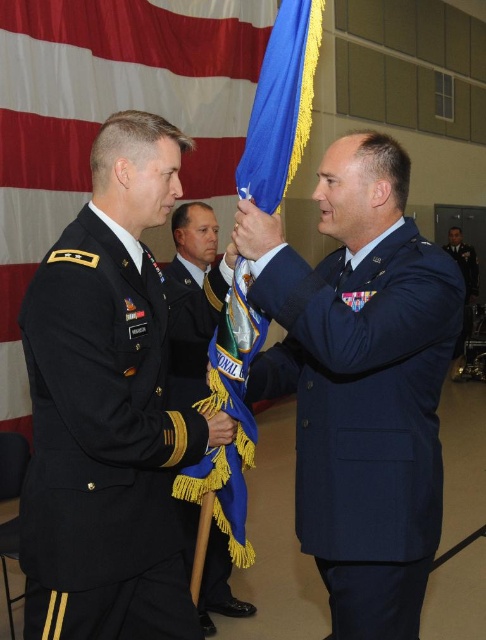
Between black matte uniform at left and blue satin flag at center, which one appears on the left side from the viewer's perspective?

Positioned to the left is black matte uniform at left.

Can you confirm if black matte uniform at left is shorter than blue satin flag at center?

In fact, black matte uniform at left may be taller than blue satin flag at center.

Between point (58, 513) and point (243, 604), which one is positioned behind?

Positioned behind is point (243, 604).

Locate an element on the screen. black matte uniform at left is located at coordinates (104, 442).

Is black matte uniform at left above blue fabric uniform at right?

No.

Is black matte uniform at left bigger than blue fabric uniform at right?

Actually, black matte uniform at left might be smaller than blue fabric uniform at right.

The image size is (486, 640). In order to click on black matte uniform at left in this screenshot , I will do `click(104, 442)`.

Is navy blue fabric uniform at center to the right of blue fabric uniform at right from the viewer's perspective?

Incorrect, navy blue fabric uniform at center is not on the right side of blue fabric uniform at right.

Between point (372, 376) and point (464, 268), which one is positioned in front?

Positioned in front is point (372, 376).

Does point (328, 346) lie in front of point (457, 348)?

Yes, point (328, 346) is closer to viewer.

Locate an element on the screen. navy blue fabric uniform at center is located at coordinates (364, 416).